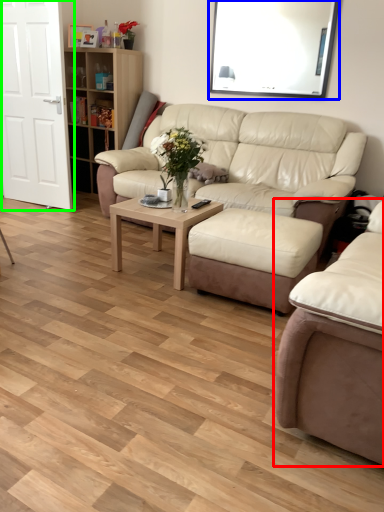
Question: Considering the real-world distances, which object is farthest from studio couch (highlighted by a red box)? window screen (highlighted by a blue box) or door (highlighted by a green box)?

Choices:
 (A) window screen
 (B) door

Answer: (A)